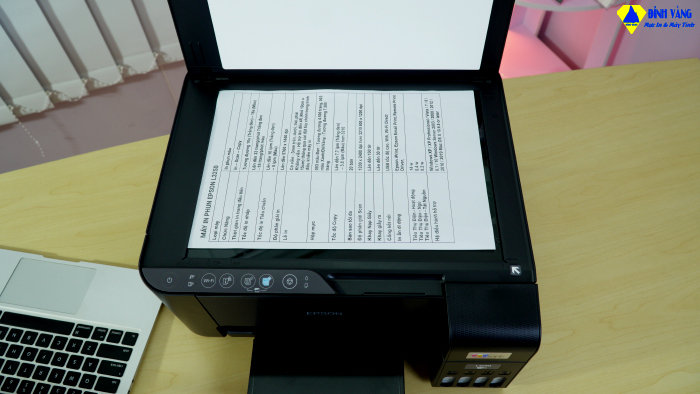
The image size is (700, 394). I want to click on vertical blinds, so click(66, 75).